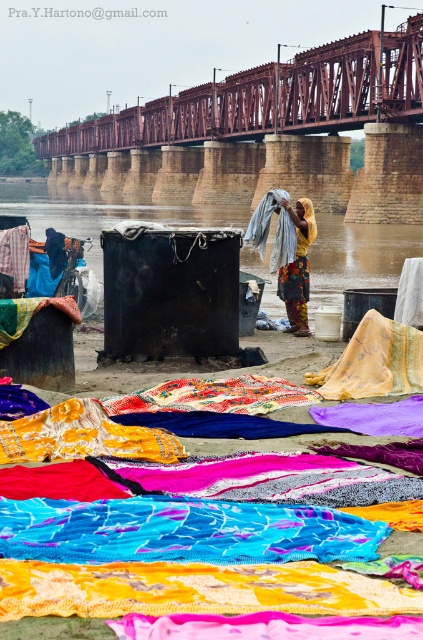
Which of these two, rusty metal bridge at upper center or multicolored fabric at center, stands shorter?

multicolored fabric at center is shorter.

Measure the distance between point (381, 104) and camera.

They are 97.59 meters apart.

At what (x,y) coordinates should I click in order to perform the action: click on rusty metal bridge at upper center. Please return your answer as a coordinate pair (x, y). The height and width of the screenshot is (640, 423). Looking at the image, I should click on point(271,99).

Locate an element on the screen. This screenshot has width=423, height=640. rusty metal bridge at upper center is located at coordinates (271, 99).

Is point (329, 129) more distant than point (420, 230)?

Yes, it is.

Looking at this image, is rusty metal bridge at upper center taller than brown concrete river at center?

No, rusty metal bridge at upper center is not taller than brown concrete river at center.

Locate an element on the screen. rusty metal bridge at upper center is located at coordinates (271, 99).

At what (x,y) coordinates should I click in order to perform the action: click on rusty metal bridge at upper center. Please return your answer as a coordinate pair (x, y). The image size is (423, 640). Looking at the image, I should click on click(271, 99).

Between rusty metal bridge at upper center and yellow sheer cloth at center, which one is positioned higher?

rusty metal bridge at upper center

Describe the element at coordinates (271, 99) in the screenshot. I see `rusty metal bridge at upper center` at that location.

The image size is (423, 640). What are the coordinates of `rusty metal bridge at upper center` in the screenshot? It's located at (271, 99).